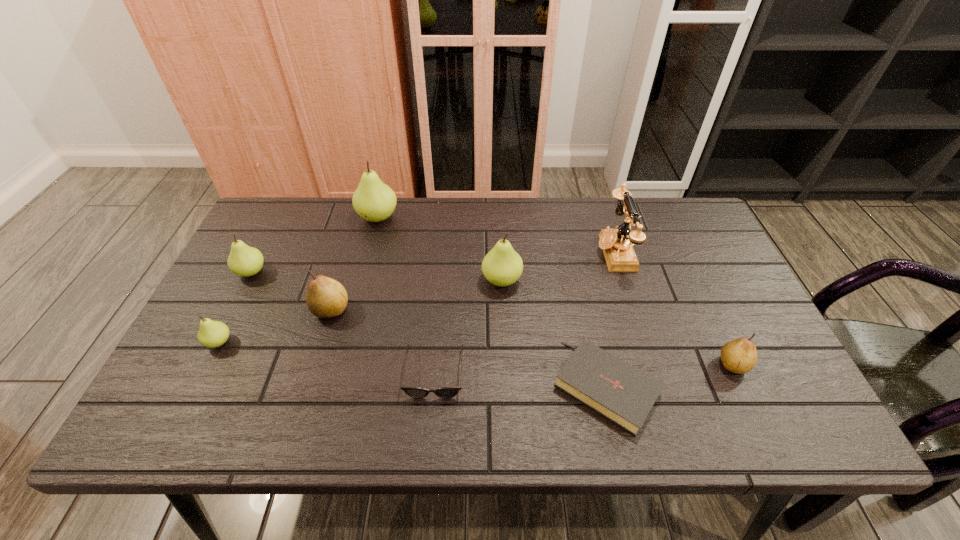
I want to click on the biggest green pear, so click(374, 201).

Where is `the third green pear from left to right`? the third green pear from left to right is located at coordinates (374, 201).

At what (x,y) coordinates should I click in order to perform the action: click on telephone. Please return your answer as a coordinate pair (x, y). Image resolution: width=960 pixels, height=540 pixels. Looking at the image, I should click on (616, 244).

Where is `the fifth shortest pear`? The width and height of the screenshot is (960, 540). the fifth shortest pear is located at coordinates (502, 266).

Find the location of a particular element. This screenshot has width=960, height=540. the third smallest green pear is located at coordinates (502, 266).

You are a GUI agent. You are given a task and a screenshot of the screen. Output one action in this format:
    pyautogui.click(x=<x>, y=<y>)
    Task: Click on the left brown pear
    This screenshot has height=540, width=960.
    Given the screenshot: What is the action you would take?
    pyautogui.click(x=325, y=297)

Find the location of a particular element. The image size is (960, 540). the fifth nearest object is located at coordinates (325, 297).

Where is `the second smallest green pear`? The image size is (960, 540). the second smallest green pear is located at coordinates (245, 261).

Image resolution: width=960 pixels, height=540 pixels. In order to click on the nearest green pear in this screenshot , I will do `click(212, 334)`.

I want to click on the smaller brown pear, so click(x=739, y=356).